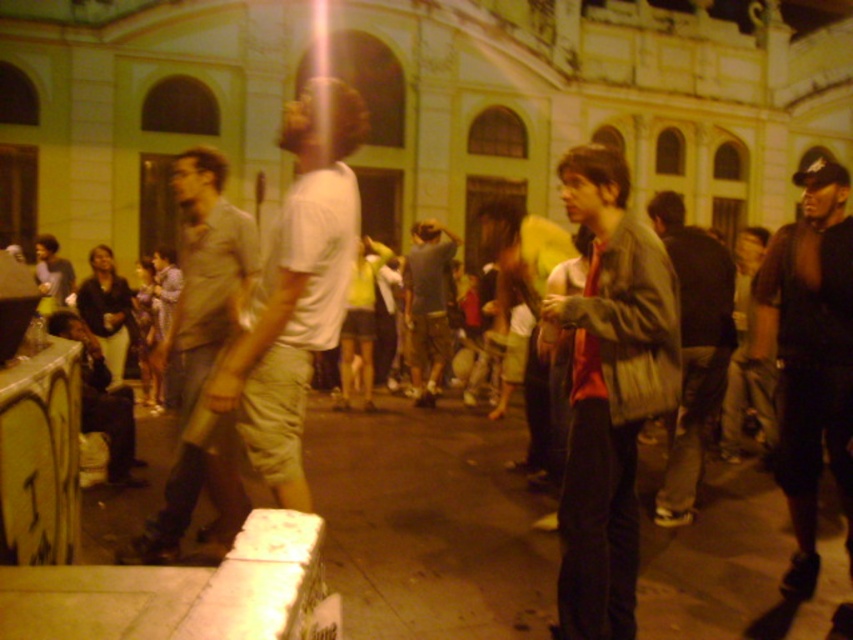
Locate an element on the screen. matte gray jacket at center is located at coordinates (693, 349).

From the picture: Which of these two, matte gray jacket at center or gray cotton t-shirt at center, stands shorter?

gray cotton t-shirt at center is shorter.

Who is more distant from viewer, (x=691, y=481) or (x=421, y=401)?

Point (x=421, y=401)

What are the coordinates of `matte gray jacket at center` in the screenshot? It's located at (693, 349).

Locate an element on the screen. The height and width of the screenshot is (640, 853). matte brown jacket at center is located at coordinates (608, 392).

Between point (621, 266) and point (252, 262), which one is positioned in front?

Point (621, 266) is in front.

Is point (579, 611) more distant than point (160, 362)?

No, (579, 611) is closer to viewer.

I want to click on matte brown jacket at center, so click(x=608, y=392).

Is matte brown jacket at center below black leather jacket at right?

Yes, matte brown jacket at center is below black leather jacket at right.

Can you confirm if matte brown jacket at center is taller than black leather jacket at right?

Incorrect, matte brown jacket at center's height is not larger of black leather jacket at right's.

The height and width of the screenshot is (640, 853). Find the location of `matte brown jacket at center`. matte brown jacket at center is located at coordinates (608, 392).